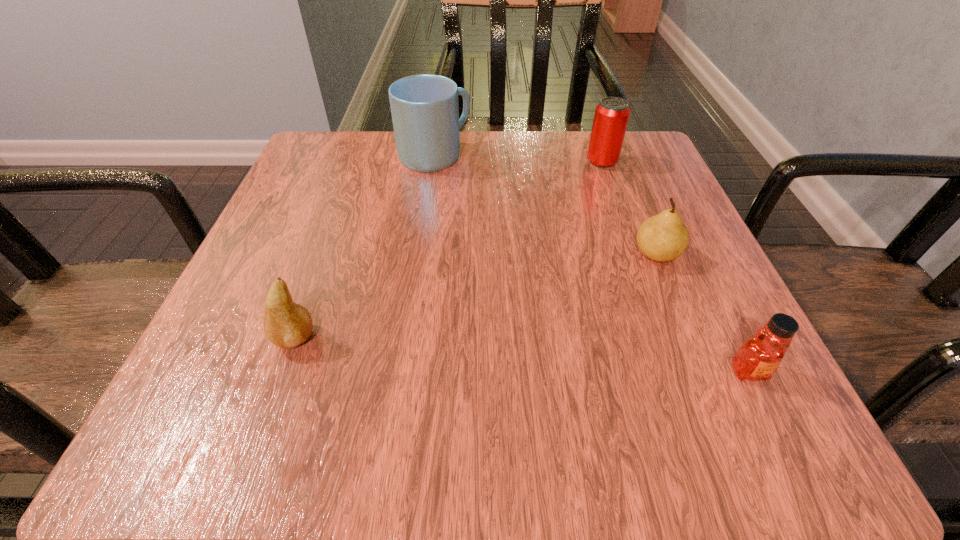
What are the coordinates of `free space between the third farthest object and the nearest object` in the screenshot? It's located at (703, 313).

Identify the location of vacant area that lies between the mug and the right pear. (545, 205).

Locate an element on the screen. The image size is (960, 540). vacant point located between the can and the mug is located at coordinates (518, 159).

Locate an element on the screen. vacant space that's between the nearer pear and the honey is located at coordinates (521, 355).

This screenshot has width=960, height=540. Identify the location of blank region between the can and the second object from left to right. (518, 159).

You are a GUI agent. You are given a task and a screenshot of the screen. Output one action in this format:
    pyautogui.click(x=<x>, y=<y>)
    Task: Click on the free space between the can and the nearest object
    
    Given the screenshot: What is the action you would take?
    675,267

The image size is (960, 540). I want to click on object that stands as the second closest to the third nearest object, so click(611, 117).

At what (x,y) coordinates should I click in order to perform the action: click on the closest object to the leftmost object. Please return your answer as a coordinate pair (x, y). Looking at the image, I should click on (425, 111).

You are a GUI agent. You are given a task and a screenshot of the screen. Output one action in this format:
    pyautogui.click(x=<x>, y=<y>)
    Task: Click on the vacant region that satisfies the following two spatial constraints: 1. on the back side of the leftmost object; 2. on the right side of the right pear
    
    Given the screenshot: What is the action you would take?
    pyautogui.click(x=324, y=254)

This screenshot has width=960, height=540. Find the location of `free space in the image that satisfies the following two spatial constraints: 1. on the back side of the farther pear; 2. on the right side of the nearer pear`. free space in the image that satisfies the following two spatial constraints: 1. on the back side of the farther pear; 2. on the right side of the nearer pear is located at coordinates (324, 254).